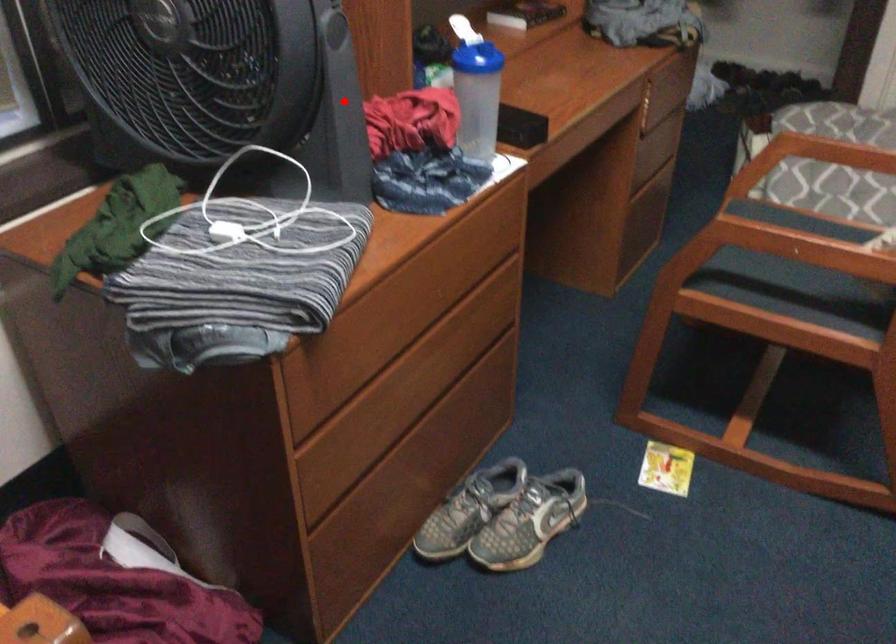
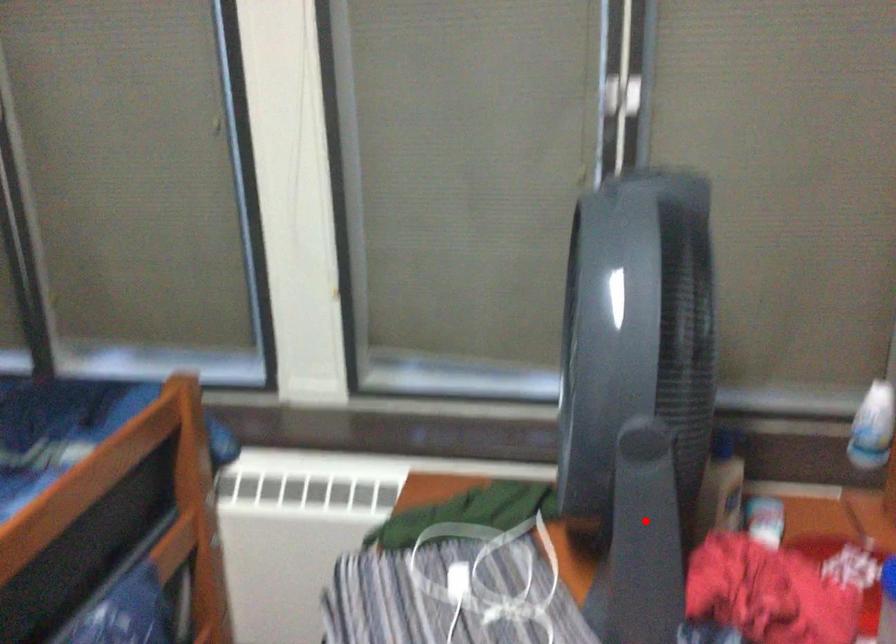
I am providing you with two images of the same scene from different viewpoints. A red point is marked on the first image and another point is marked on the second image. Is the marked point in image1 the same physical position as the marked point in image2?

Yes